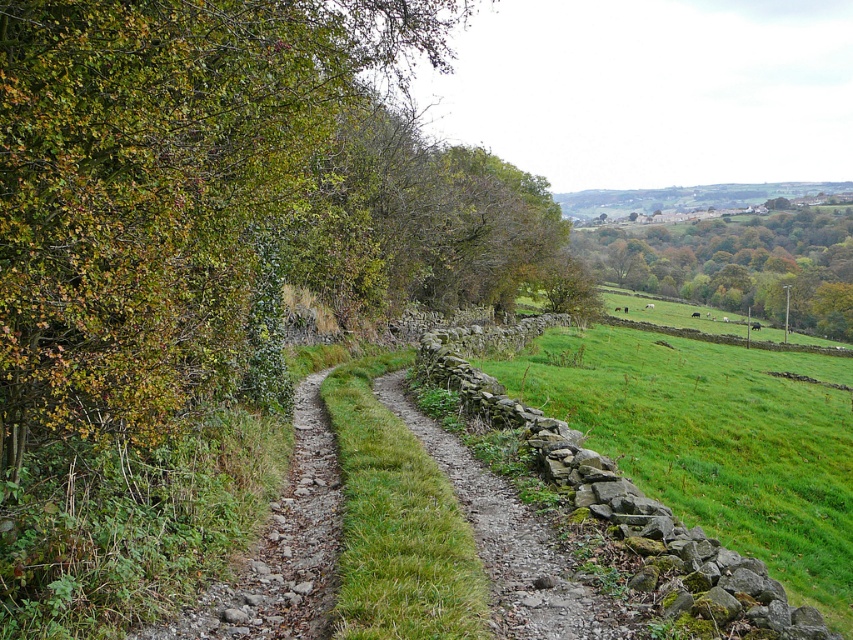
You are standing at the center of the dirt path in the rural landscape. You notice a green leafy tree at upper right. Can you determine its position relative to your current location?

The green leafy tree at upper right is located at coordinates approximately 0.412 on the x axis and 0.866 on the y axis, which places it towards the upper right corner of the scene from your current position at the center of the dirt path.

You are standing on the dirt path and want to walk towards the green leafy tree at upper right. Which direction should you walk to get closer to it without entering the green grassy field at right?

To avoid the green grassy field at right, walk towards the green leafy tree at upper right along the path, as the green grassy field at right is behind the tree from your perspective.

You are a hiker trying to navigate through the green grassy field at right and the green leafy tree at upper right. Which area would you choose to walk through if you want to cover more ground quickly?

The green leafy tree at upper right has a larger size than the green grassy field at right, so walking through the green grassy field at right would allow you to cover more ground quickly since it is smaller in size.